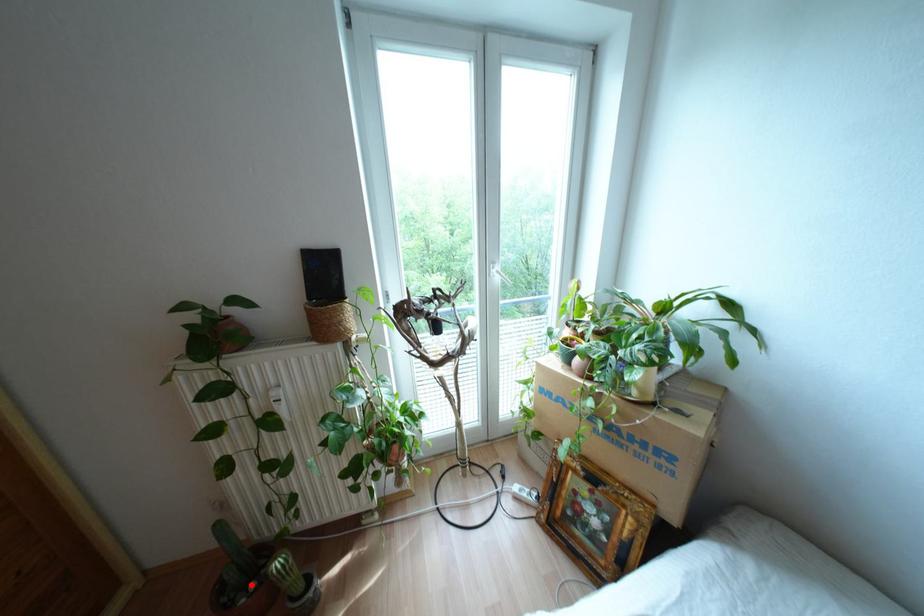
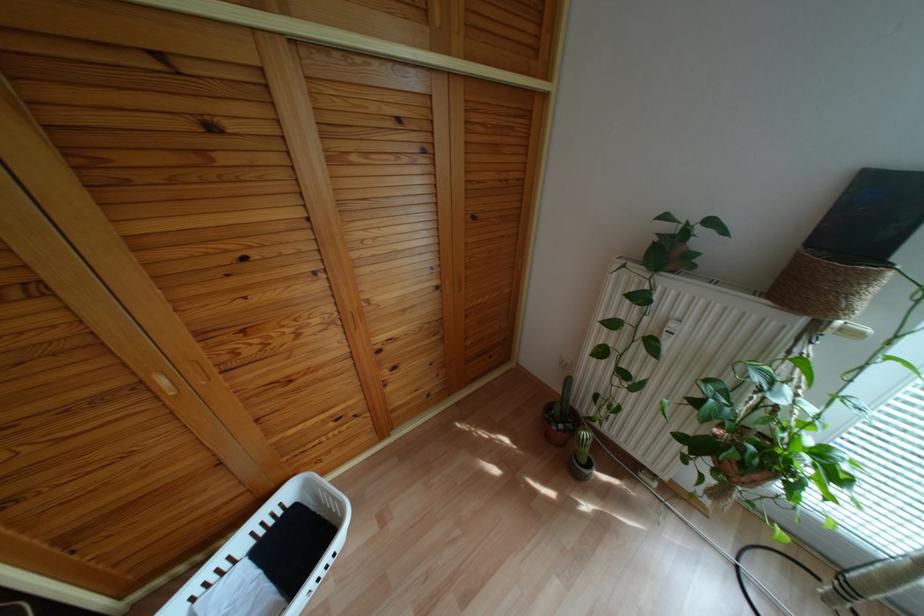
Where in the second image is the point corresponding to the highlighted location from the first image?

(560, 424)